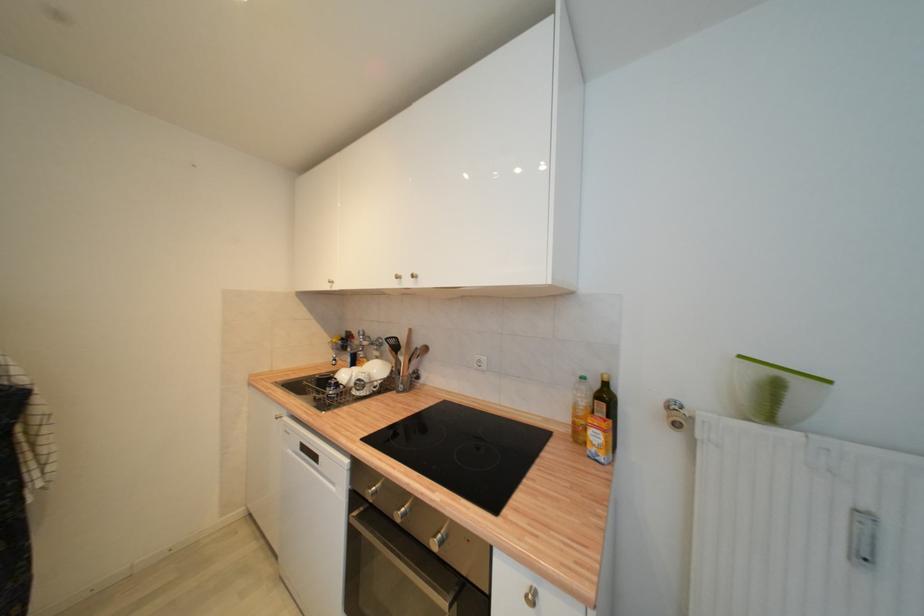
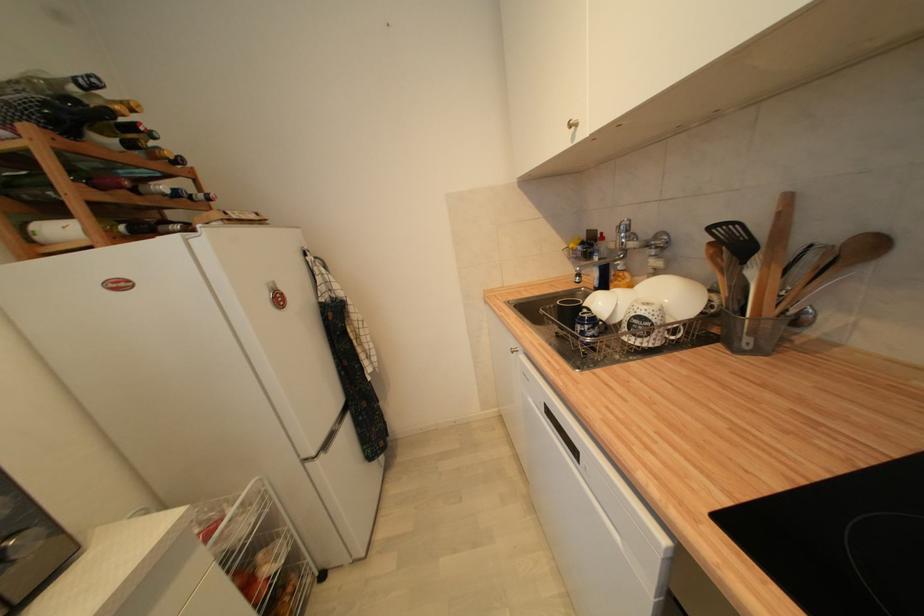
The point at [392,341] is marked in the first image. Where is the corresponding point in the second image?

(715, 230)